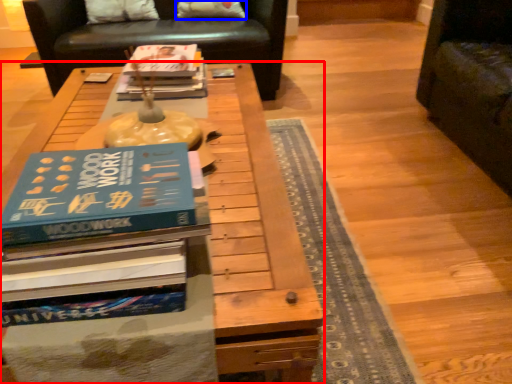
Question: Which object is further to the camera taking this photo, table (highlighted by a red box) or pillow (highlighted by a blue box)?

Choices:
 (A) table
 (B) pillow

Answer: (B)